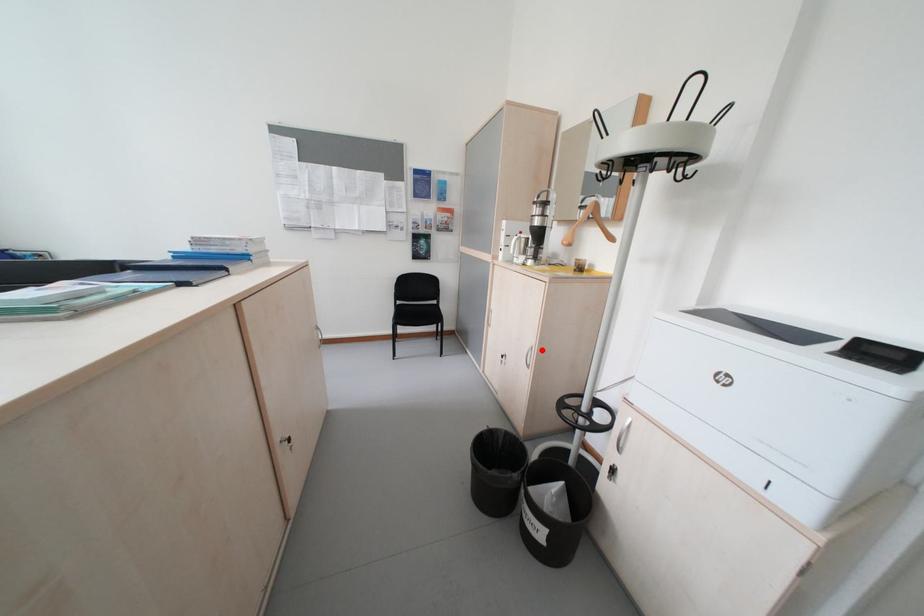
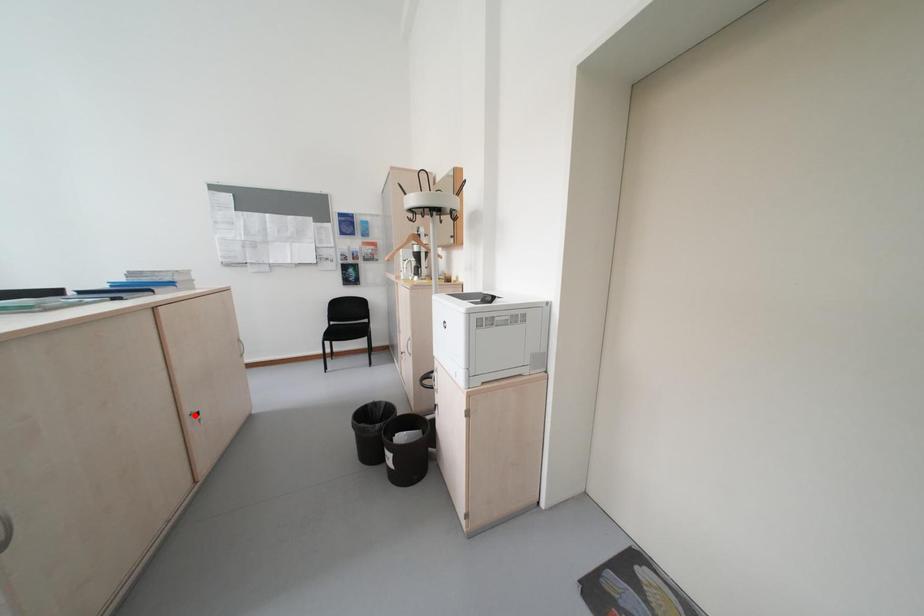
I am providing you with two images of the same scene from different viewpoints. A red point is marked on the first image and another point is marked on the second image. Are the points marked in image1 and image2 representing the same 3D position?

No